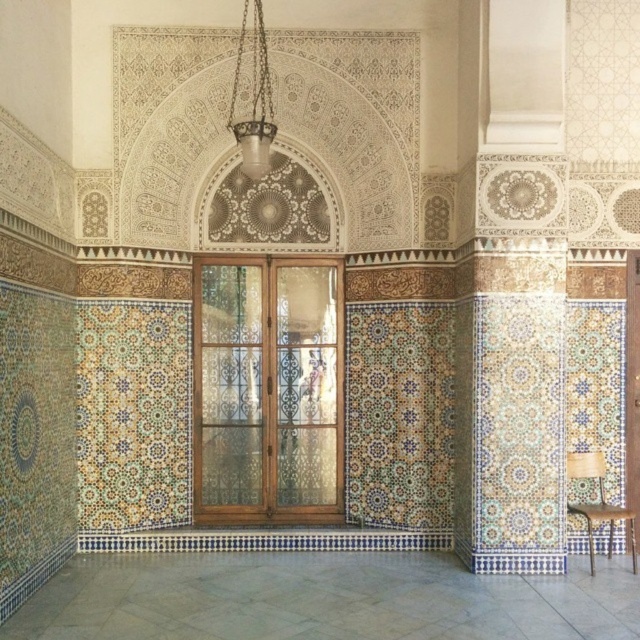
You are a guest entering the room and want to sit down. You see the metallic gold chandelier at upper center and the wooden chair at lower right. Which object is positioned higher in the room?

The metallic gold chandelier at upper center is positioned higher in the room than the wooden chair at lower right.

You are standing in the Moroccan inspired room and want to know which point is closer to you. The points are point [230,323] and point [259,76]. Which point is closer to you?

Point [259,76] is closer to you because it is less further to the camera than point [230,323].